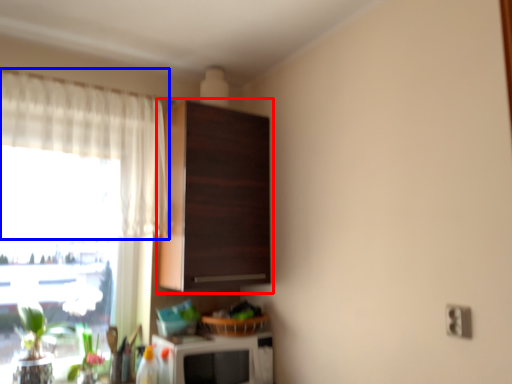
Question: Among these objects, which one is farthest to the camera, cabinetry (highlighted by a red box) or curtain (highlighted by a blue box)?

Choices:
 (A) cabinetry
 (B) curtain

Answer: (A)